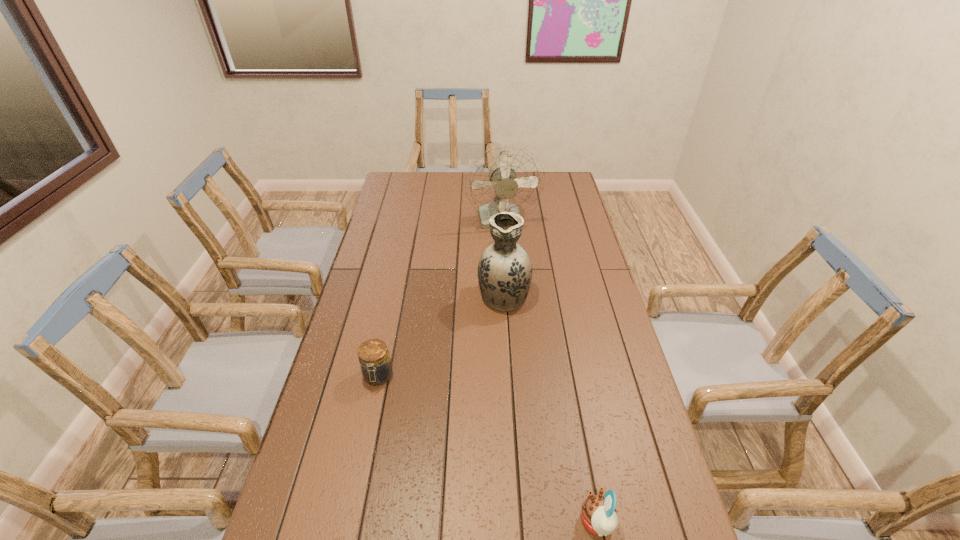
Identify the location of free space located 0.150m on the lid of the leftmost object. (365, 441).

Locate an element on the screen. This screenshot has height=540, width=960. object that is at the left edge is located at coordinates (376, 367).

In the image, there is a desktop. Where is `vacant space at the left edge`? vacant space at the left edge is located at coordinates (324, 480).

Where is `vacant space at the right edge of the desktop`? vacant space at the right edge of the desktop is located at coordinates (615, 539).

You are a GUI agent. You are given a task and a screenshot of the screen. Output one action in this format:
    pyautogui.click(x=<x>, y=<y>)
    Task: Click on the vacant area at the far left corner
    This screenshot has width=960, height=540.
    Given the screenshot: What is the action you would take?
    pos(402,180)

The width and height of the screenshot is (960, 540). Identify the location of free space at the far right corner. (545, 182).

Image resolution: width=960 pixels, height=540 pixels. Find the location of `free spot between the jar and the fan`. free spot between the jar and the fan is located at coordinates (441, 299).

At what (x,y) coordinates should I click in order to perform the action: click on the third closest object to the leftmost object. Please return your answer as a coordinate pair (x, y). The image size is (960, 540). Looking at the image, I should click on (505, 179).

Select which object is the second closest to the fan. Please provide its 2D coordinates. Your answer should be formatted as a tuple, i.e. [(x, y)], where the tuple contains the x and y coordinates of a point satisfying the conditions above.

[(376, 367)]